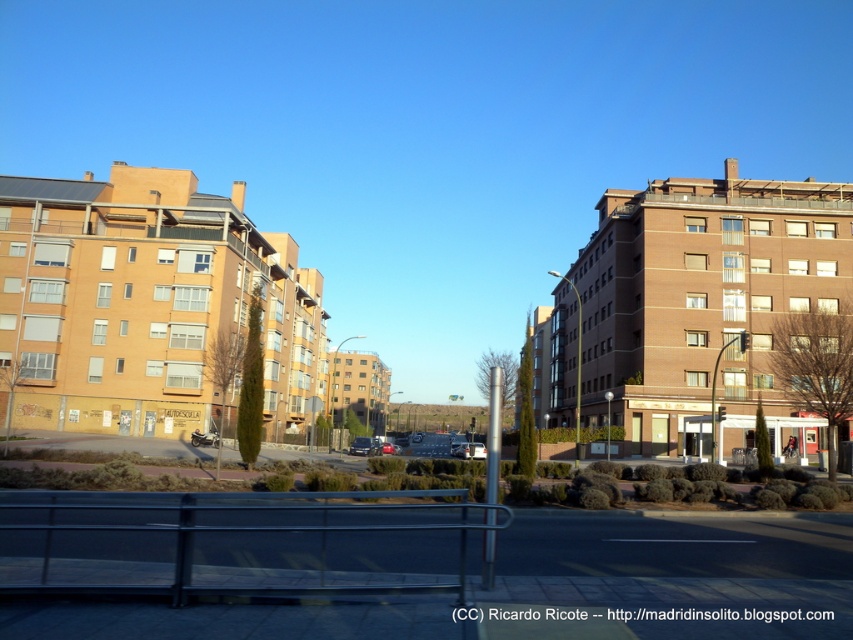
Question: Which point appears closest to the camera in this image?

Choices:
 (A) (380, 451)
 (B) (467, 451)
 (C) (360, 451)

Answer: (B)

Question: Does silver metallic car at center appear on the right side of shiny metallic car at center?

Choices:
 (A) yes
 (B) no

Answer: (A)

Question: Which point appears farthest from the camera in this image?

Choices:
 (A) (354, 449)
 (B) (383, 448)

Answer: (B)

Question: Is metallic silver car at center above shiny metallic car at center?

Choices:
 (A) yes
 (B) no

Answer: (A)

Question: Does metallic silver car at center have a lesser width compared to silver metallic car at center?

Choices:
 (A) yes
 (B) no

Answer: (B)

Question: Considering the real-world distances, which object is farthest from the metallic silver car at center?

Choices:
 (A) shiny metallic car at center
 (B) silver metallic car at center

Answer: (B)